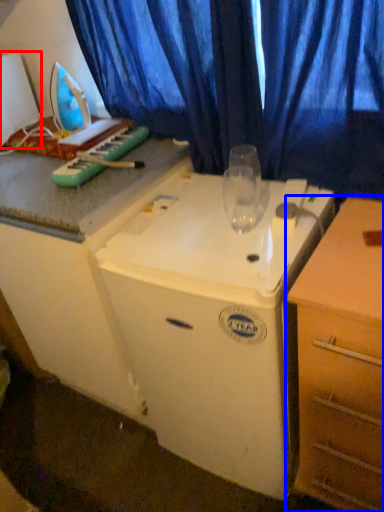
Question: Which point is closer to the camera, appliance (highlighted by a red box) or chest of drawers (highlighted by a blue box)?

Choices:
 (A) appliance
 (B) chest of drawers

Answer: (B)